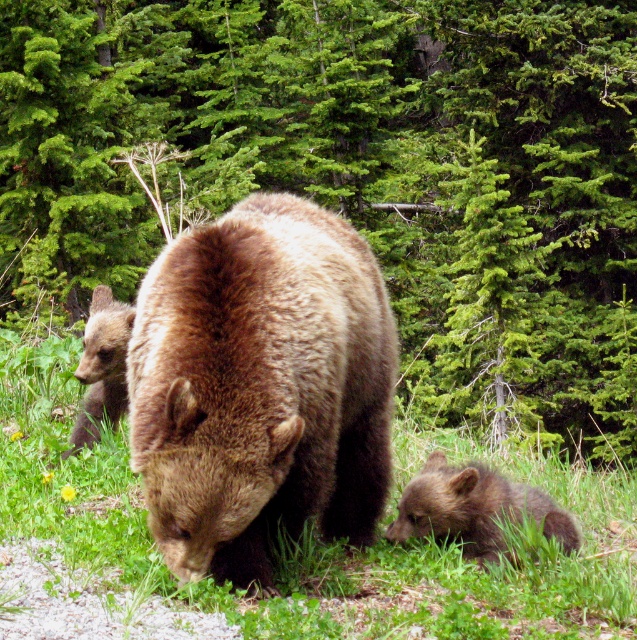
You are a photographer standing in the forest scene. You notice two points marked in the image. One is at coordinates point [475,16] and the other is at point [359,602]. Which point is closer to your camera?

Point [475,16] is further to the camera than point [359,602], so the closer point to your camera is point [359,602].

You are a hiker who wants to take a photo of the green evergreen tree at center and the green soft grass at center. Since you want both in focus, you need to know which one is closer to you. Can you tell me which is closer?

The green evergreen tree at center is bigger than green soft grass at center, so the tree is closer to you because larger objects in the same scene are typically nearer to the observer.

You are standing in the forest and see two points marked in the image. Which point, point (573,561) or point (555,513), is nearer to you?

Point (573,561) is closer to the viewer than point (555,513).